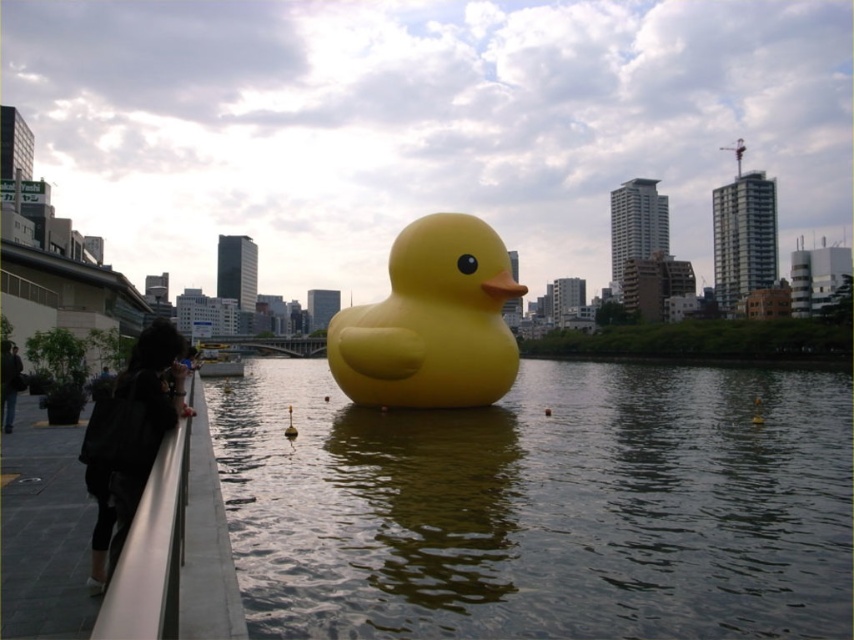
You are standing on a bridge overlooking the river where the yellow rubber duck at center is floating. You want to take a photo of the duck but need to know if you can fit the entire duck in your camera frame. Your camera has a maximum viewing distance of 100 feet. Can you capture the duck in full without moving closer?

The yellow rubber duck at center is 120.51 feet away from the camera. Since your camera can only view up to 100 feet, you cannot capture the duck in full without moving closer.

You are a photographer planning to capture the yellow rubber duck at center and the black fabric jacket at lower left in the same frame. Based on their sizes, which object would appear smaller in the photo?

The yellow rubber duck at center would appear smaller in the photo because its width is less than that of the black fabric jacket at lower left.